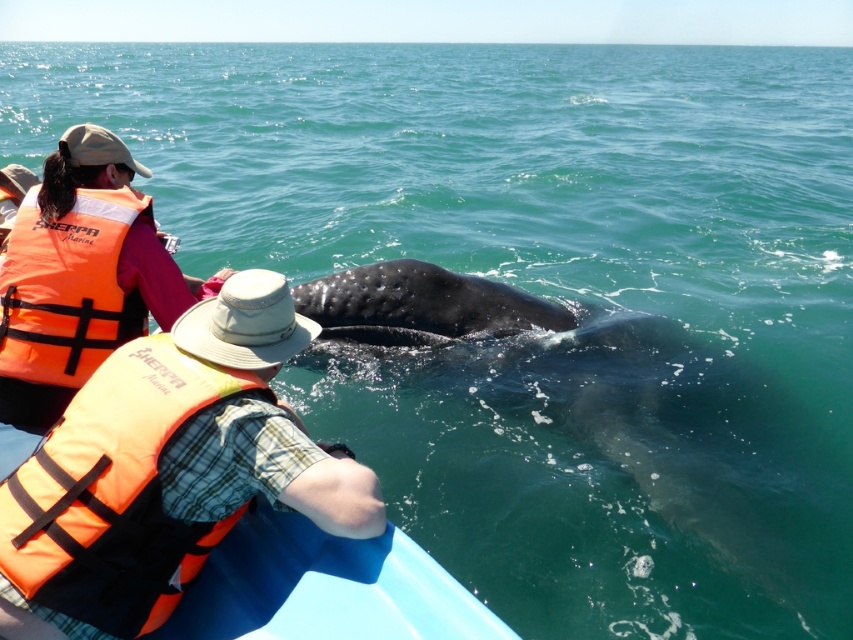
Between orange fabric life jacket at lower left and orange life jacket at left, which one has more height?

With more height is orange fabric life jacket at lower left.

What do you see at coordinates (113, 493) in the screenshot? This screenshot has width=853, height=640. I see `orange fabric life jacket at lower left` at bounding box center [113, 493].

Which is behind, point (15, 576) or point (9, 365)?

The point (9, 365) is more distant.

Identify the location of orange fabric life jacket at lower left. This screenshot has width=853, height=640. (113, 493).